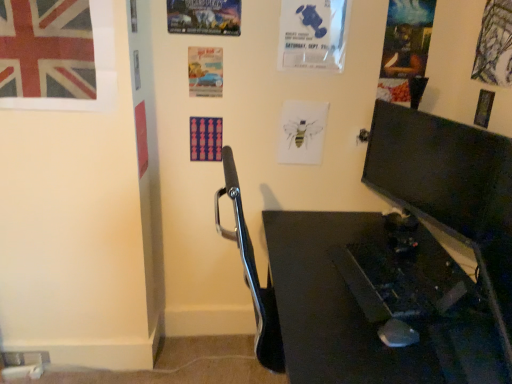
Question: From the image's perspective, is metallic poster at upper center, positioned as the 5th poster page in right-to-left order, located above or below oil painting portrait at upper right, the fifth poster page positioned from the left?

Choices:
 (A) below
 (B) above

Answer: (B)

Question: Is metallic poster at upper center, positioned as the 5th poster page in right-to-left order, spatially inside oil painting portrait at upper right, which is the second poster page from right to left, or outside of it?

Choices:
 (A) inside
 (B) outside

Answer: (B)

Question: Which of these objects is positioned closest to the matte black monitor at right?

Choices:
 (A) metallic silver poster at upper right, acting as the 6th poster page starting from the left
 (B) oil painting portrait at upper right, the fifth poster page positioned from the left
 (C) matte paper poster at center, the 1th poster page when ordered from left to right
 (D) blue paper poster at upper center, which is the 4th poster page from left to right
 (E) union jack fabric poster at upper left

Answer: (B)

Question: Which of these objects is positioned closest to the matte black monitor at right?

Choices:
 (A) matte paper poster at center, the 1th poster page when ordered from left to right
 (B) black glossy desk at lower right
 (C) blue paper poster at upper center, which is the 4th poster page from left to right
 (D) metallic poster at upper center, positioned as the 5th poster page in right-to-left order
 (E) oil painting portrait at upper right, which is the second poster page from right to left

Answer: (B)